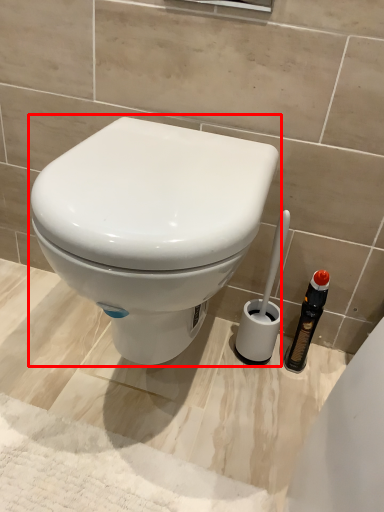
Question: From the image's perspective, considering the relative positions of toilet (annotated by the red box) and brush in the image provided, where is toilet (annotated by the red box) located with respect to the staircase?

Choices:
 (A) below
 (B) above

Answer: (B)